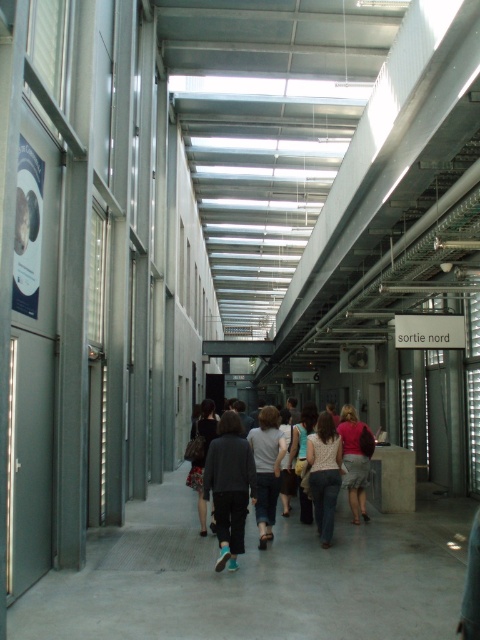
Question: Which point is closer to the camera taking this photo?

Choices:
 (A) (344, 454)
 (B) (228, 420)
 (C) (219, 570)

Answer: (C)

Question: Considering the real-world distances, which object is closest to the dark gray pants at center?

Choices:
 (A) matte pink shirt at center
 (B) patterned fabric blouse at center
 (C) light gray cotton shirt at center
 (D) floral skirt at center

Answer: (C)

Question: Does patterned fabric blouse at center have a smaller size compared to light gray cotton shirt at center?

Choices:
 (A) no
 (B) yes

Answer: (B)

Question: Does patterned fabric blouse at center come behind matte pink shirt at center?

Choices:
 (A) yes
 (B) no

Answer: (B)

Question: Where is dark gray sweater at center located in relation to light gray cotton shirt at center in the image?

Choices:
 (A) left
 (B) right

Answer: (A)

Question: Which object is farther from the camera taking this photo?

Choices:
 (A) floral skirt at center
 (B) matte pink shirt at center
 (C) light gray cotton shirt at center
 (D) dark gray sweater at center

Answer: (B)